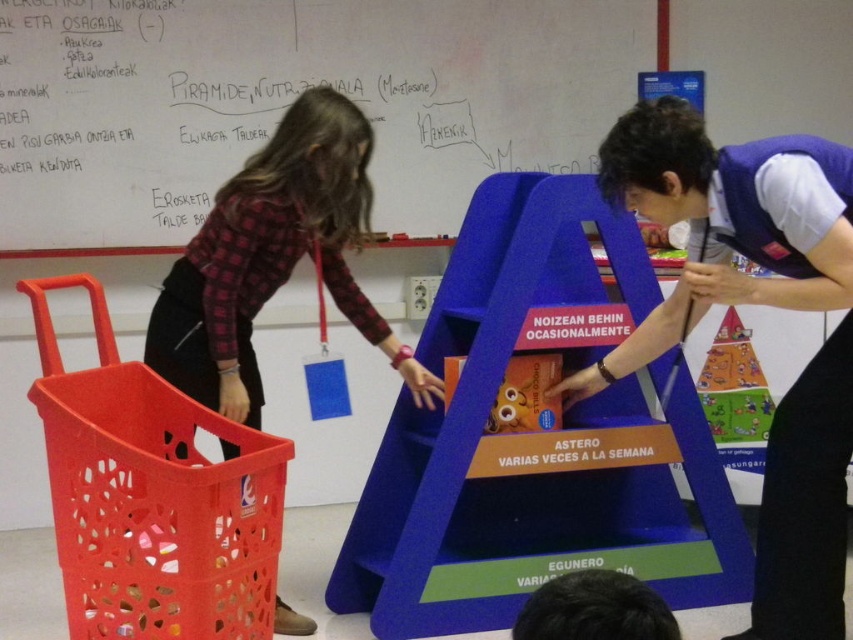
Question: Can you confirm if blue plastic ladder at center is positioned above plaid fabric shirt at center?

Choices:
 (A) yes
 (B) no

Answer: (B)

Question: Which object appears farthest from the camera in this image?

Choices:
 (A) plaid fabric shirt at center
 (B) matte plastic toy at center
 (C) matte blue pyramid at center

Answer: (B)

Question: Which of the following is the closest to the observer?

Choices:
 (A) (431, 556)
 (B) (234, 349)
 (C) (149, 488)
 (D) (490, 429)

Answer: (C)

Question: Can you confirm if blue plastic ladder at center is smaller than orange plastic basket at left?

Choices:
 (A) yes
 (B) no

Answer: (B)

Question: Is whiteboard at upper center above matte plastic toy at center?

Choices:
 (A) yes
 (B) no

Answer: (A)

Question: Considering the real-world distances, which object is farthest from the matte plastic toy at center?

Choices:
 (A) plaid fabric shirt at center
 (B) whiteboard at upper center
 (C) blue plastic ladder at center
 (D) matte blue pyramid at center

Answer: (B)